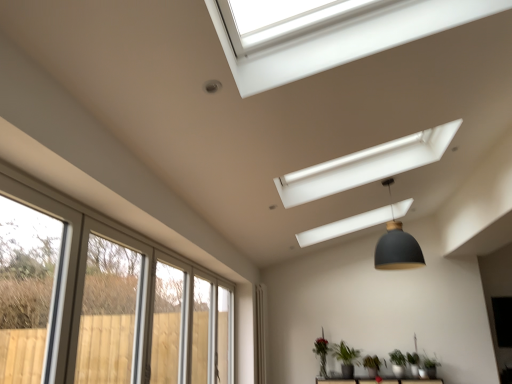
Question: From the image's perspective, is green matte plant at lower center, the 4th plant viewed from the left, below white fabric curtain at lower center?

Choices:
 (A) no
 (B) yes

Answer: (B)

Question: From a real-world perspective, is green matte plant at lower center, the 1th plant viewed from the right, beneath white fabric curtain at lower center?

Choices:
 (A) no
 (B) yes

Answer: (B)

Question: Can you confirm if green matte plant at lower center, the 4th plant viewed from the left, is taller than white fabric curtain at lower center?

Choices:
 (A) no
 (B) yes

Answer: (A)

Question: Is green matte plant at lower center, the 1th plant viewed from the right, located outside white fabric curtain at lower center?

Choices:
 (A) yes
 (B) no

Answer: (A)

Question: Does green matte plant at lower center, the 1th plant viewed from the right, come behind white fabric curtain at lower center?

Choices:
 (A) yes
 (B) no

Answer: (B)

Question: Considering the positions of green matte plant at lower center, the fourth plant from the right, and matte black pendant lamp at center in the image, is green matte plant at lower center, the fourth plant from the right, bigger or smaller than matte black pendant lamp at center?

Choices:
 (A) small
 (B) big

Answer: (A)

Question: Considering the positions of point (324, 342) and point (409, 251), is point (324, 342) closer or farther from the camera than point (409, 251)?

Choices:
 (A) closer
 (B) farther

Answer: (B)

Question: From the image's perspective, relative to matte black pendant lamp at center, is green matte plant at lower center, the fourth plant from the right, above or below?

Choices:
 (A) above
 (B) below

Answer: (B)

Question: Considering their positions, is green matte plant at lower center, the fourth plant from the right, located in front of or behind matte black pendant lamp at center?

Choices:
 (A) behind
 (B) front

Answer: (A)

Question: Is clear glass screen door at lower left wider or thinner than green matte plant at lower center, the 2th plant in the left-to-right sequence?

Choices:
 (A) thin
 (B) wide

Answer: (A)

Question: Based on their positions, is clear glass screen door at lower left located to the left or right of green matte plant at lower center, the 2th plant in the left-to-right sequence?

Choices:
 (A) left
 (B) right

Answer: (A)

Question: From a real-world perspective, is clear glass screen door at lower left above or below green matte plant at lower center, the 2th plant in the left-to-right sequence?

Choices:
 (A) above
 (B) below

Answer: (A)

Question: Considering the positions of point (155, 304) and point (348, 354), is point (155, 304) closer or farther from the camera than point (348, 354)?

Choices:
 (A) farther
 (B) closer

Answer: (B)

Question: Based on their positions, is matte black pendant lamp at center located to the left or right of green matte plant at lower center, the 2th plant in the left-to-right sequence?

Choices:
 (A) left
 (B) right

Answer: (B)

Question: Considering the positions of matte black pendant lamp at center and green matte plant at lower center, the third plant from the right, in the image, is matte black pendant lamp at center bigger or smaller than green matte plant at lower center, the third plant from the right,?

Choices:
 (A) small
 (B) big

Answer: (B)